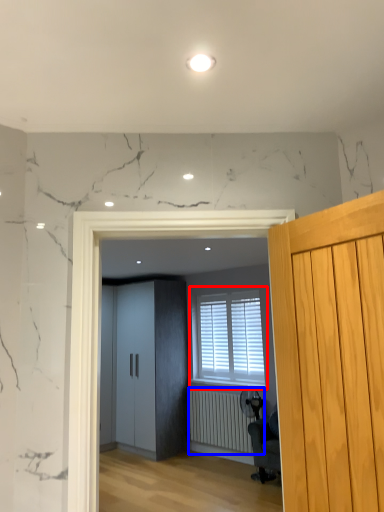
Question: Which point is further to the camera, window (highlighted by a red box) or radiator (highlighted by a blue box)?

Choices:
 (A) window
 (B) radiator

Answer: (A)